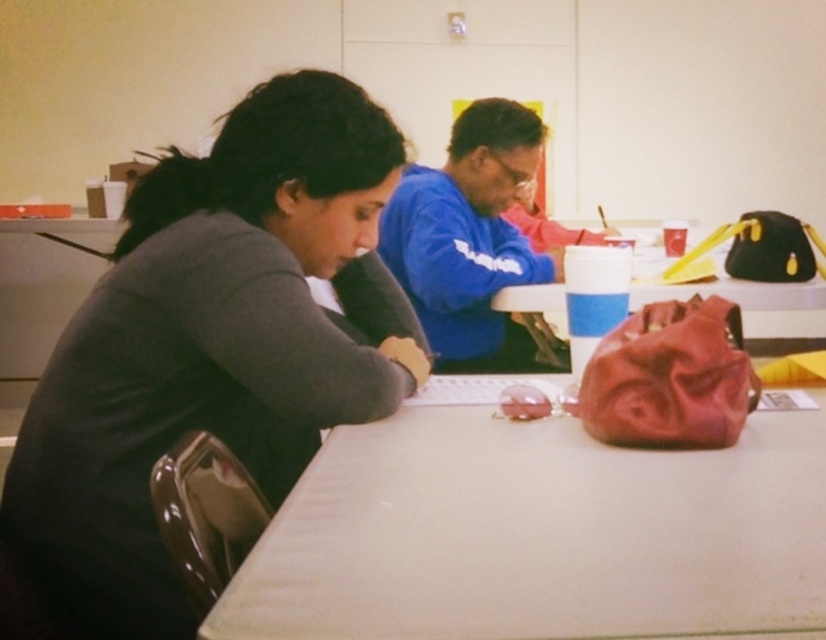
Who is higher up, blue fleece sweatshirt at center or rubberized red bag at center?

blue fleece sweatshirt at center is higher up.

Is blue fleece sweatshirt at center smaller than rubberized red bag at center?

No, blue fleece sweatshirt at center is not smaller than rubberized red bag at center.

What are the coordinates of `blue fleece sweatshirt at center` in the screenshot? It's located at (468, 230).

Find the location of `white matte table at center`. white matte table at center is located at coordinates (539, 534).

Is white matte table at center bigger than rubberized red bag at center?

Yes.

Between point (774, 516) and point (820, 326), which one is positioned behind?

Point (820, 326)

Where is `white matte table at center`? This screenshot has width=826, height=640. white matte table at center is located at coordinates (539, 534).

Is dark gray sweater at center above white matte table at center?

Yes.

Which of these two, dark gray sweater at center or white matte table at center, stands taller?

Standing taller between the two is dark gray sweater at center.

Does point (212, 221) come in front of point (820, 611)?

No, it is behind (820, 611).

The height and width of the screenshot is (640, 826). I want to click on dark gray sweater at center, so click(212, 346).